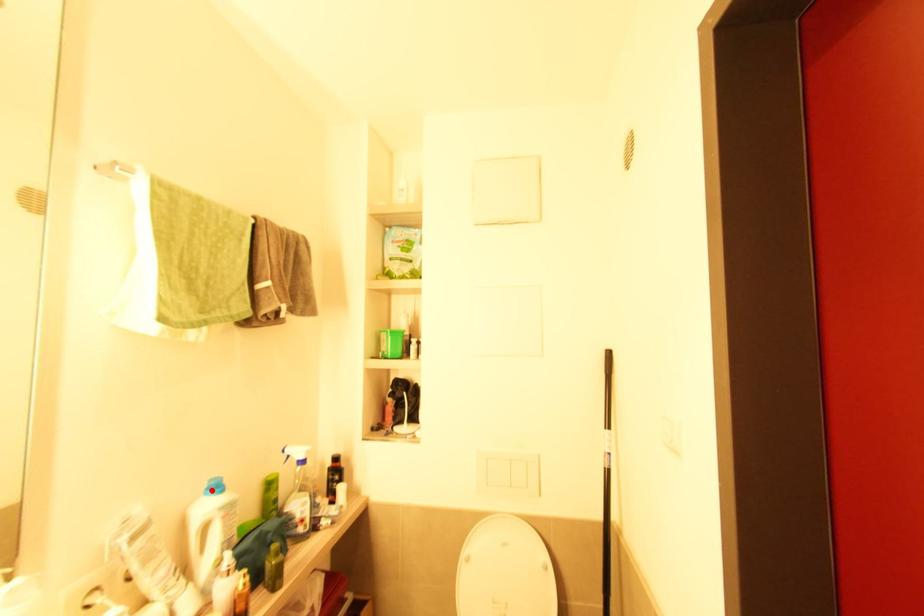
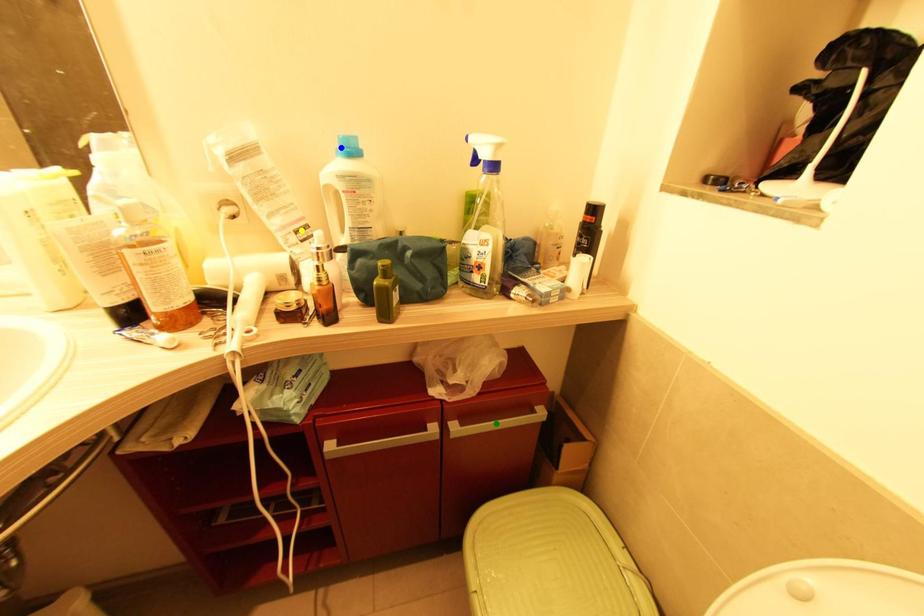
Question: I am providing you with two images of the same scene from different viewpoints. A red point is marked on the first image. You are given multiple points on the second image. Which point in image 2 represents the same 3d spot as the red point in image 1?

Choices:
 (A) yellow point
 (B) green point
 (C) blue point

Answer: (C)